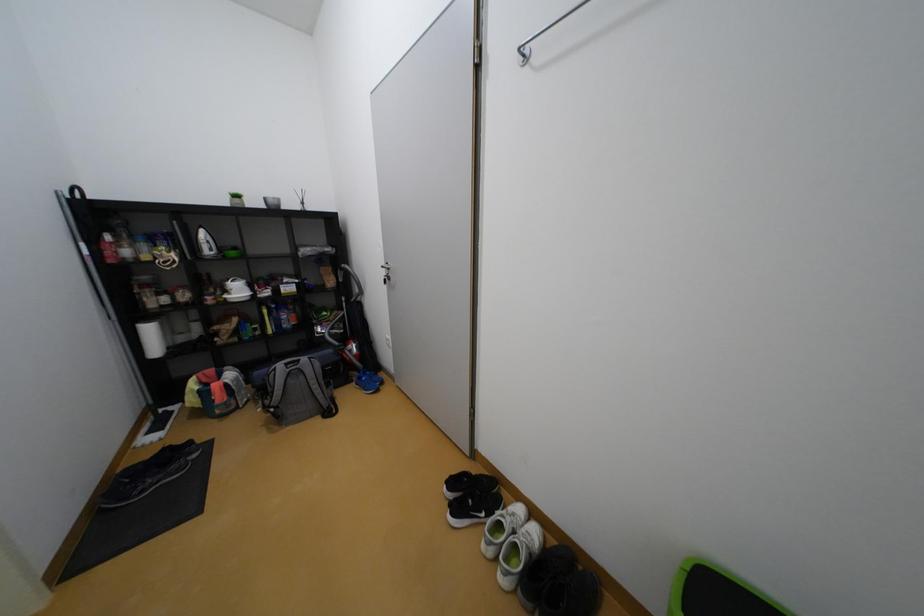
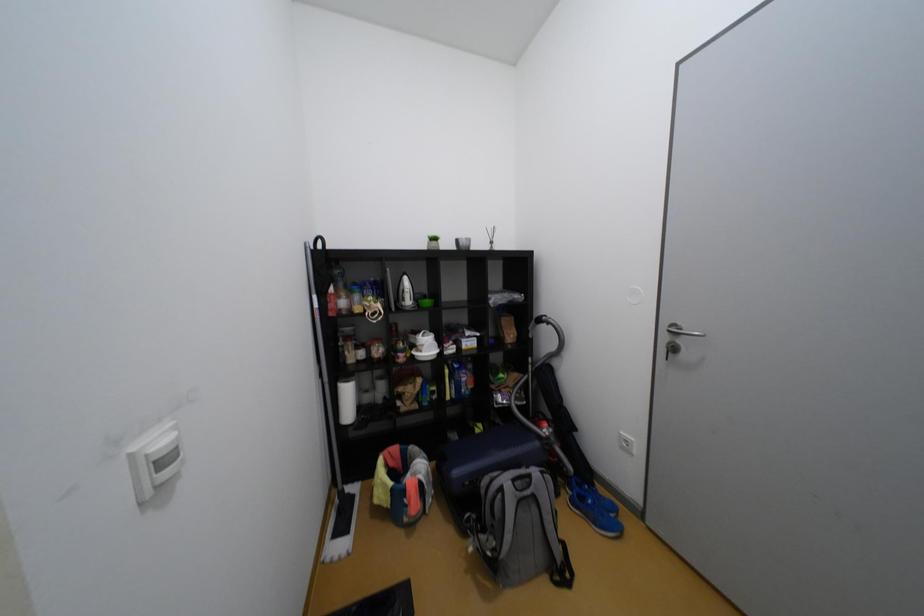
What movement of the cameraman would produce the second image?

The cameraman moved toward left, forward.